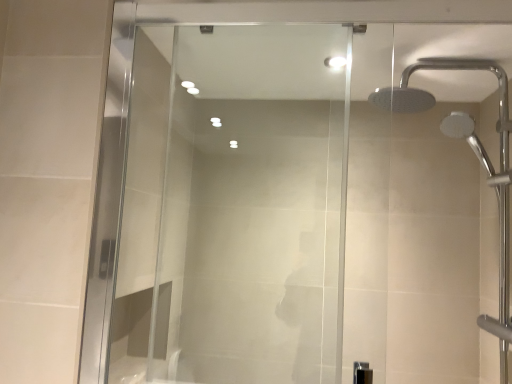
This screenshot has width=512, height=384. Describe the element at coordinates (234, 208) in the screenshot. I see `transparent glass screen door at center` at that location.

What is the approximate height of transparent glass screen door at center?

The height of transparent glass screen door at center is 37.25 inches.

Where is `transparent glass screen door at center`? Image resolution: width=512 pixels, height=384 pixels. transparent glass screen door at center is located at coordinates (234, 208).

Identify the location of transparent glass screen door at center. (234, 208).